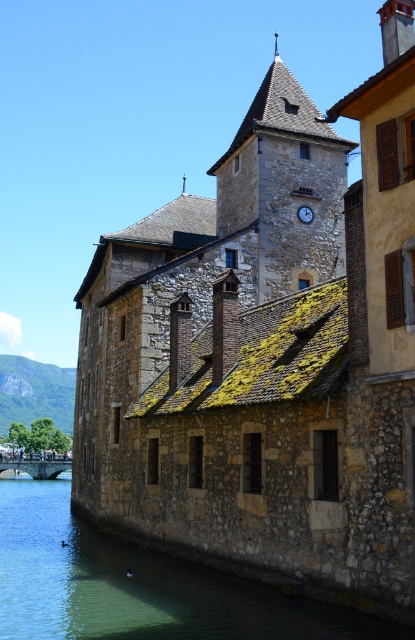
You are an architect inspecting the stone building. You notice the stone clock tower at center and the black metallic clock at upper center. Which of these two objects has a greater width?

The stone clock tower at center is wider than the black metallic clock at upper center according to the description.

You are standing in front of the stone building by the water. There is a point marked at coordinates (285, 184). Can you tell me what part of the building this point is located on?

The point at coordinates (285, 184) is located on the stone clock tower at center.

Consider the image. You are standing in front of the historic stone building by the water. You notice the clear water at river lower left and the black metallic clock at upper center. Which object is located to the left of the other?

The clear water at river lower left is positioned on the left side of black metallic clock at upper center.